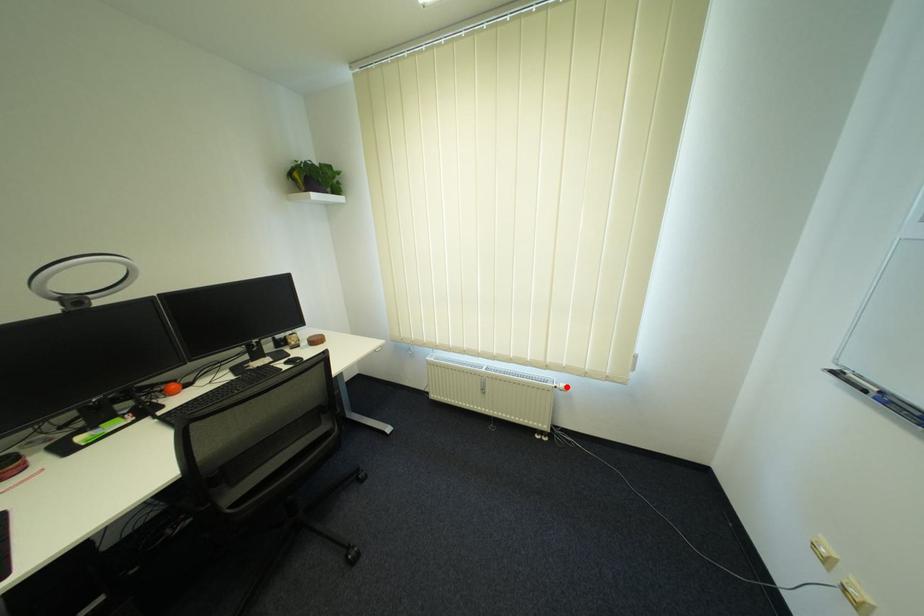
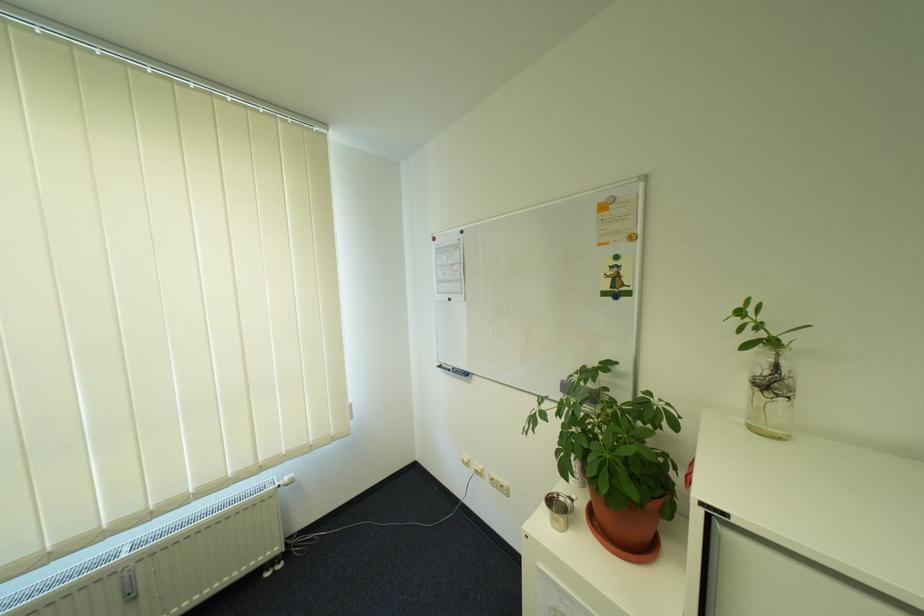
In the second image, find the point that corresponds to the highlighted location in the first image.

(290, 484)